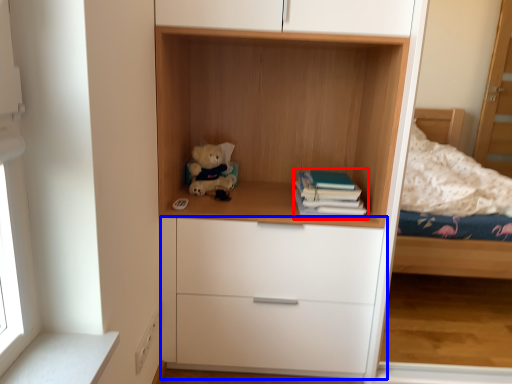
Question: Which object is further to the camera taking this photo, paperback book (highlighted by a red box) or chest of drawers (highlighted by a blue box)?

Choices:
 (A) paperback book
 (B) chest of drawers

Answer: (A)